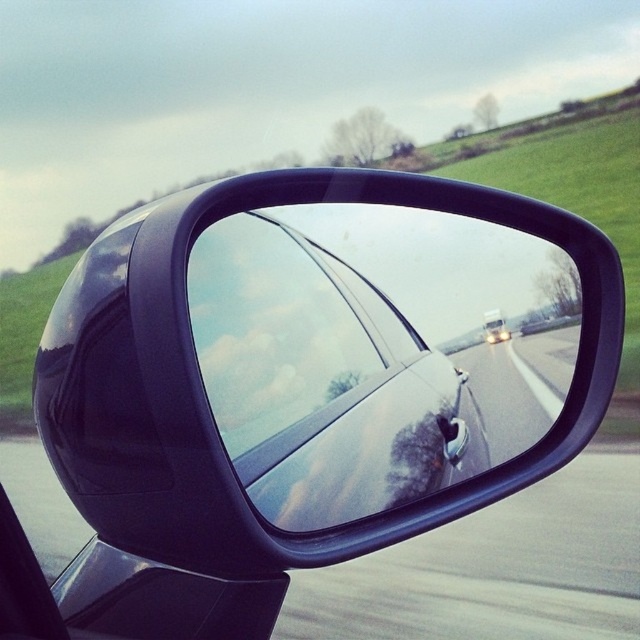
You are a driver checking your car mirrors before starting your journey. You notice the glossy black mirror at center. Based on its position at point 0.552, 0.88, can you determine if it is properly adjusted to see the entire lane behind you?

The glossy black mirror at center is positioned at point (376,353), which means it is adjusted correctly to provide a clear view of the entire lane behind you.

You are a passenger in a car and want to check the glossy black mirror at center to see if there is a white vehicle approaching from behind. Can you see the white vehicle in the mirror?

The glossy black mirror at center is 36.03 inches away from the viewer. Since the mirror reflects the road ahead, including the white vehicle in the distance, you can see the white vehicle in the glossy black mirror at center.

You are driving a car and want to check your side mirror. Based on the image, which object, the glossy black mirror at center or the white glossy car at center, is positioned lower in the mirror?

The glossy black mirror at center is positioned lower than the white glossy car at center in the mirror.